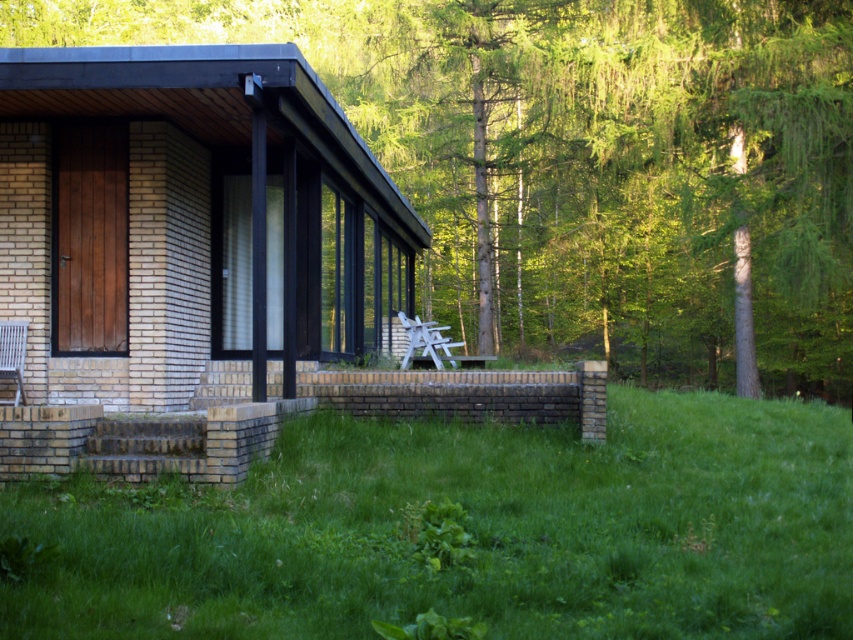
Question: Estimate the real-world distances between objects in this image. Which object is farther from the green leafy tree at upper center?

Choices:
 (A) green grass at lower center
 (B) brick cabin at center
 (C) white plastic chair at lower left
 (D) brick wall at lower left

Answer: (D)

Question: Is green grass at lower center closer to camera compared to brick wall at lower left?

Choices:
 (A) yes
 (B) no

Answer: (A)

Question: Which point is closer to the camera?

Choices:
 (A) brick wall at lower left
 (B) green leafy tree at upper center
 (C) white plastic chair at center
 (D) green grass at lower center

Answer: (D)

Question: Is green leafy tree at upper center smaller than brick wall at lower left?

Choices:
 (A) no
 (B) yes

Answer: (A)

Question: Does green leafy tree at upper center have a smaller size compared to white plastic chair at center?

Choices:
 (A) no
 (B) yes

Answer: (A)

Question: Which object is the farthest from the white plastic chair at center?

Choices:
 (A) white plastic chair at lower left
 (B) brick wall at lower left

Answer: (B)